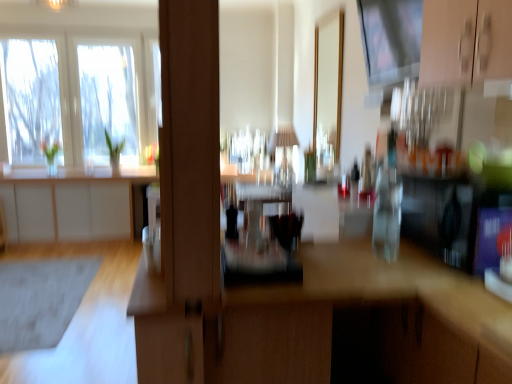
Question: Considering the relative sizes of gray matte rug at lower left and white matte cabinet at left in the image provided, is gray matte rug at lower left bigger than white matte cabinet at left?

Choices:
 (A) no
 (B) yes

Answer: (A)

Question: From a real-world perspective, is gray matte rug at lower left below white matte cabinet at left?

Choices:
 (A) yes
 (B) no

Answer: (A)

Question: Is gray matte rug at lower left with white matte cabinet at left?

Choices:
 (A) no
 (B) yes

Answer: (A)

Question: Can you confirm if gray matte rug at lower left is wider than white matte cabinet at left?

Choices:
 (A) yes
 (B) no

Answer: (A)

Question: Does gray matte rug at lower left have a smaller size compared to white matte cabinet at left?

Choices:
 (A) no
 (B) yes

Answer: (B)

Question: From a real-world perspective, is transparent glass window screen at upper center positioned above or below white matte cabinet at left?

Choices:
 (A) below
 (B) above

Answer: (B)

Question: Would you say transparent glass window screen at upper center is to the left or to the right of white matte cabinet at left in the picture?

Choices:
 (A) right
 (B) left

Answer: (A)

Question: Choose the correct answer: Is transparent glass window screen at upper center inside white matte cabinet at left or outside it?

Choices:
 (A) inside
 (B) outside

Answer: (B)

Question: In terms of height, does transparent glass window screen at upper center look taller or shorter compared to white matte cabinet at left?

Choices:
 (A) tall
 (B) short

Answer: (B)

Question: From the image's perspective, is wooden desk at center above or below clear glass window at upper left?

Choices:
 (A) below
 (B) above

Answer: (A)

Question: Is point tap(453, 314) closer or farther from the camera than point tap(138, 135)?

Choices:
 (A) closer
 (B) farther

Answer: (A)

Question: Considering the positions of wooden desk at center and clear glass window at upper left in the image, is wooden desk at center taller or shorter than clear glass window at upper left?

Choices:
 (A) short
 (B) tall

Answer: (A)

Question: Based on their positions, is wooden desk at center located to the left or right of clear glass window at upper left?

Choices:
 (A) right
 (B) left

Answer: (A)

Question: Based on their positions, is transparent glass window screen at upper center located to the left or right of clear glass window at upper left?

Choices:
 (A) right
 (B) left

Answer: (A)

Question: Is transparent glass window screen at upper center in front of or behind clear glass window at upper left in the image?

Choices:
 (A) behind
 (B) front

Answer: (B)